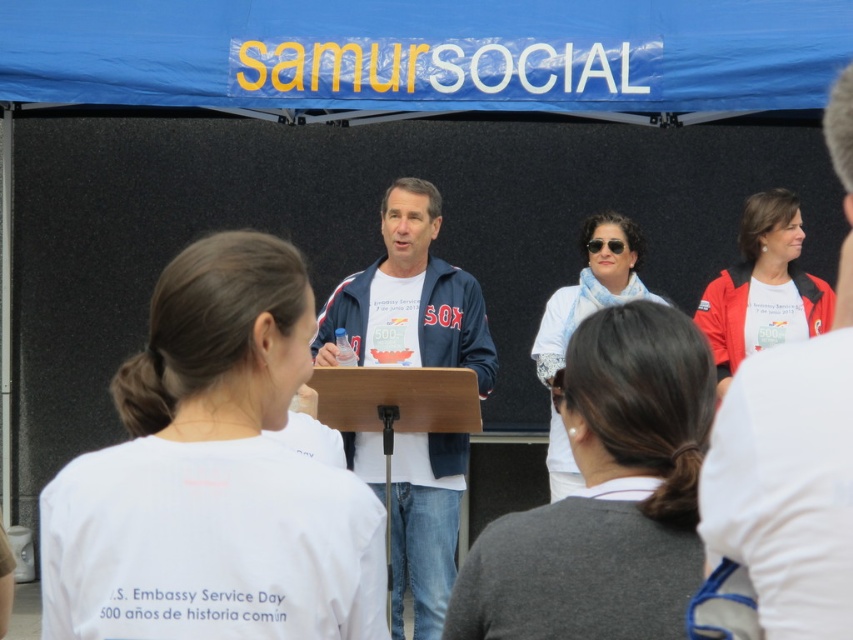
You are at the event and need to locate the two jackets at the center. Which jacket is positioned lower between the matte blue jacket at center and the blue denim jacket at center?

The matte blue jacket at center is positioned lower than the blue denim jacket at center.

You are attending the event and want to get a better view of the speaker at the podium. Which jacket, the blue denim jacket at center or the white matte jacket at upper right, is blocking your view more?

The white matte jacket at upper right is behind the blue denim jacket at center, so the blue denim jacket at center is blocking your view more.